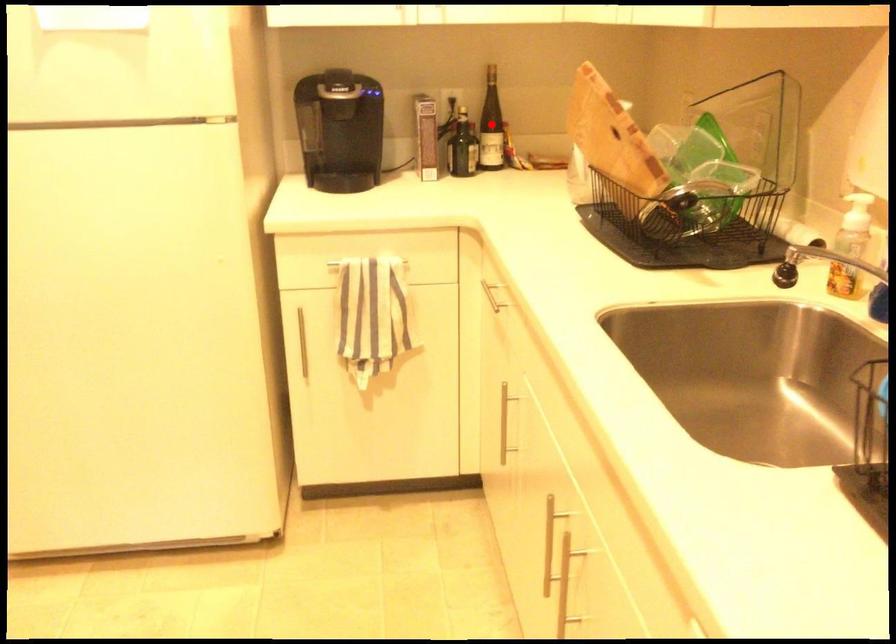
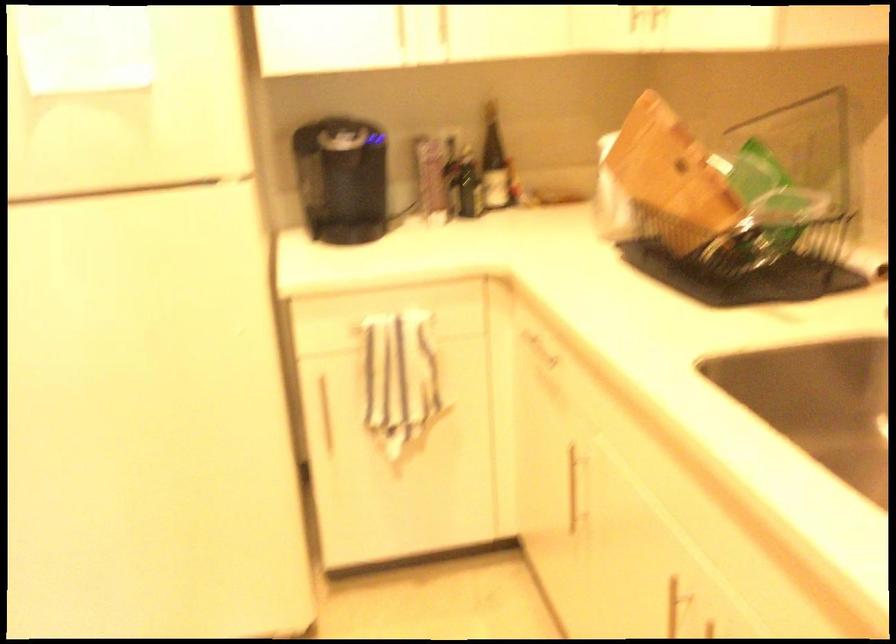
In the second image, find the point that corresponds to the highlighted location in the first image.

(494, 163)